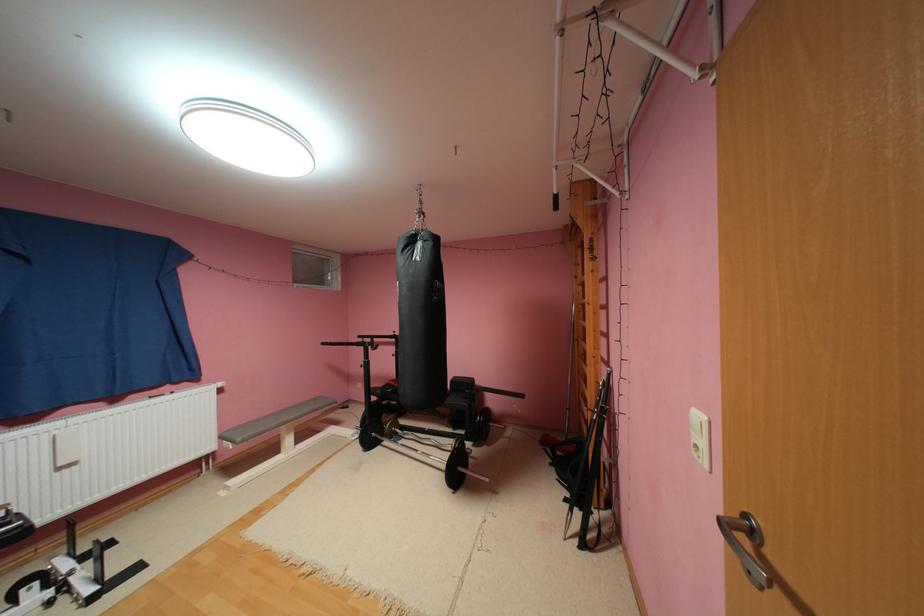
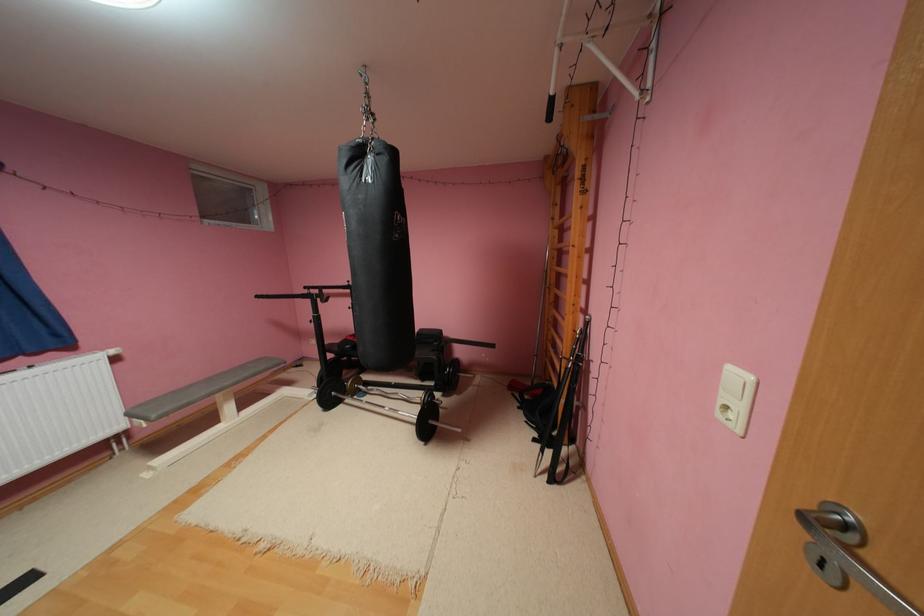
Question: The images are taken continuously from a first-person perspective. In which direction is your viewpoint rotating?

Choices:
 (A) Left
 (B) Right
 (C) Up
 (D) Down

Answer: (D)